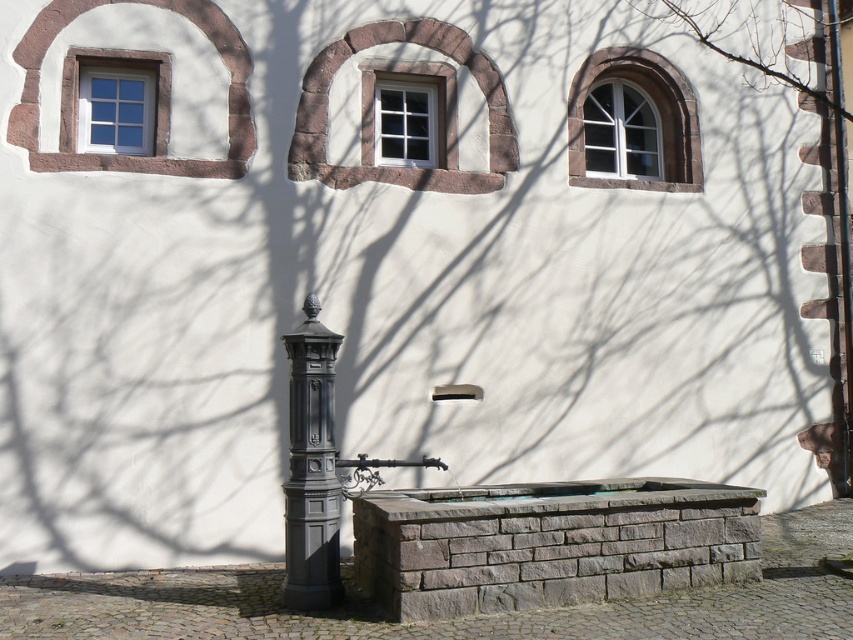
You are a painter who needs to know the height of the windows to estimate the amount of paint required. Given that the white glass window at center is shorter than the white glass window at upper right, which one will require more paint for its frame?

The white glass window at upper right will require more paint for its frame because it is taller than the white glass window at center.

You are an architect designing a new building and want to ensure proper lighting. Given the white glass window at center and the matte white window at upper left, which window allows more natural light into the building?

The white glass window at center allows more natural light into the building because it has a greater height compared to the matte white window at upper left.

You are standing 30 feet away from the building wall. You see the white glass window at center. Can you reach the window by walking straight ahead?

The white glass window at center is 33.59 feet away from the viewer. Since you are currently 30 feet away from the building wall, you would need to walk an additional 3.59 feet forward to reach the window.